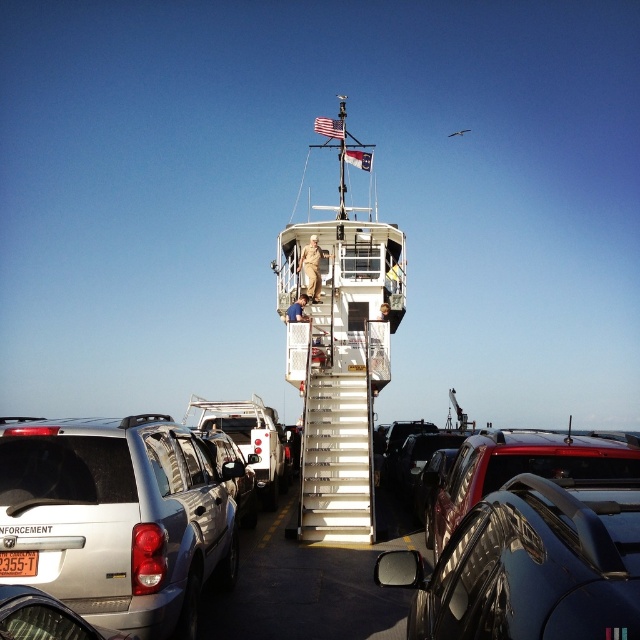
You are a delivery driver who needs to park your truck between the silver metallic suv at lower left and the silver metallic car at lower left. Can you fit your truck that is 15 feet long into the space between them?

The space between the silver metallic suv at lower left and the silver metallic car at lower left is 6.45 feet. Since your truck is 15 feet long, it cannot fit into the space between the silver metallic suv at lower left and the silver metallic car at lower left.

You are standing at point (80, 618) and want to walk to point (628, 451). Given that there are several vehicles parked around, do you think you can see your destination from where you are standing?

Point (628, 451) is behind point (80, 618), so you cannot see your destination from where you are standing because it is obstructed by the vehicles parked between them.